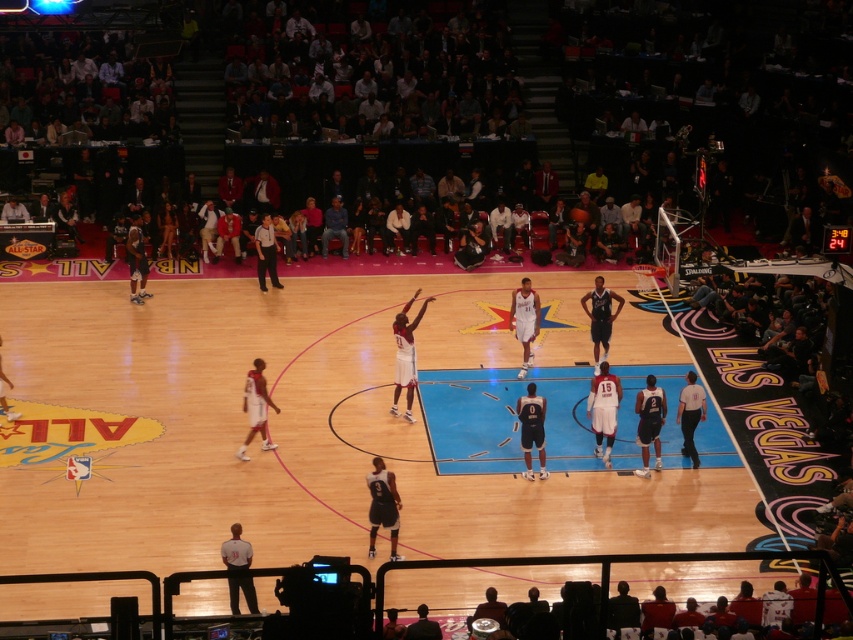
Question: Is white glossy jersey at center positioned before white matte jersey at center?

Choices:
 (A) no
 (B) yes

Answer: (B)

Question: Is white matte jersey at center positioned behind shiny black basketball at center?

Choices:
 (A) no
 (B) yes

Answer: (A)

Question: Among these points, which one is nearest to the camera?

Choices:
 (A) (581, 211)
 (B) (227, 563)
 (C) (688, 376)
 (D) (248, 442)

Answer: (B)

Question: Among these objects, which one is farthest from the camera?

Choices:
 (A) shiny black basketball at center
 (B) gray fabric shirt at lower left

Answer: (A)

Question: Can you confirm if dark blue jersey at center is thinner than denim jeans at center?

Choices:
 (A) yes
 (B) no

Answer: (B)

Question: Which point is farther to the camera?

Choices:
 (A) dark blue jersey at center
 (B) denim jeans at center
 (C) gray fabric shirt at lower left

Answer: (B)